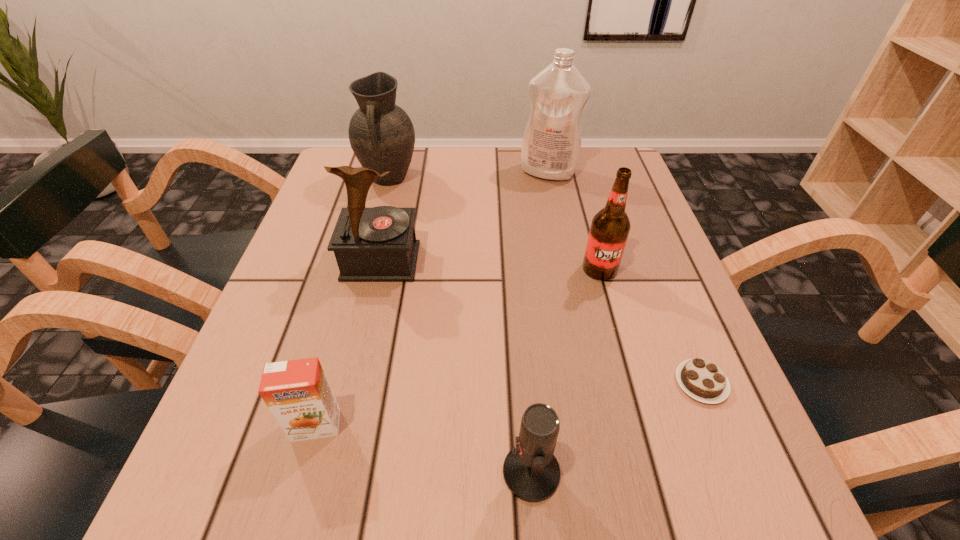
Where is `unoccupied position between the second nearest object and the nearest object`? This screenshot has height=540, width=960. unoccupied position between the second nearest object and the nearest object is located at coordinates (423, 449).

The height and width of the screenshot is (540, 960). Identify the location of unoccupied area between the root beer and the microphone. (565, 370).

Find the location of a particular element. Image resolution: width=960 pixels, height=540 pixels. free space between the chocolate cake and the detergent is located at coordinates (625, 278).

Locate an element on the screen. Image resolution: width=960 pixels, height=540 pixels. free area in between the sixth farthest object and the root beer is located at coordinates (458, 347).

Where is `free space that is in between the root beer and the detergent`? The height and width of the screenshot is (540, 960). free space that is in between the root beer and the detergent is located at coordinates (574, 220).

The image size is (960, 540). What are the coordinates of `object that is the closest to the orange juice` in the screenshot? It's located at (531, 472).

Identify which object is the third closest to the shortest object. Please provide its 2D coordinates. Your answer should be formatted as a tuple, i.e. [(x, y)], where the tuple contains the x and y coordinates of a point satisfying the conditions above.

[(378, 244)]

At what (x,y) coordinates should I click in order to perform the action: click on free point that satisfies the following two spatial constraints: 1. on the front side of the root beer; 2. on the right side of the detergent. Please return your answer as a coordinate pair (x, y). Looking at the image, I should click on (568, 269).

What are the coordinates of `vacant space that satisfies the following two spatial constraints: 1. at the horn opening of the phonograph_record; 2. on the right side of the root beer` in the screenshot? It's located at (379, 269).

Image resolution: width=960 pixels, height=540 pixels. I want to click on vacant point that satisfies the following two spatial constraints: 1. on the side of the root beer with the handle; 2. on the right side of the pitcher, so click(x=365, y=269).